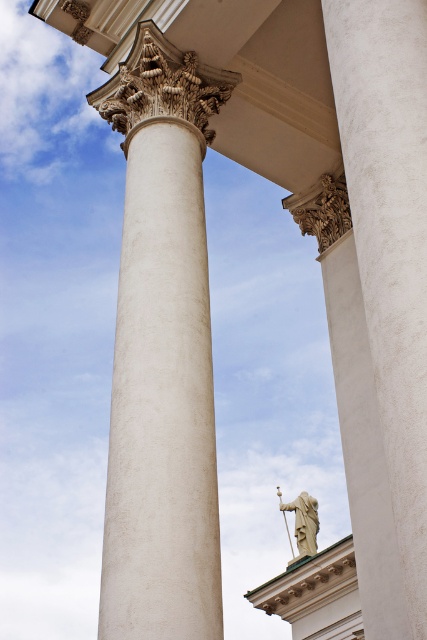
Question: Among these points, which one is nearest to the camera?

Choices:
 (A) (312, 540)
 (B) (389, 413)
 (C) (204, 356)

Answer: (B)

Question: Is the position of white smooth column at center less distant than that of stone statue at center?

Choices:
 (A) no
 (B) yes

Answer: (B)

Question: Is white smooth column at center above stone statue at center?

Choices:
 (A) yes
 (B) no

Answer: (A)

Question: Which point is farther from the camera taking this photo?

Choices:
 (A) (181, 548)
 (B) (301, 513)
 (C) (342, 42)

Answer: (B)

Question: Which is nearer to the white marble column at center?

Choices:
 (A) white smooth column at center
 (B) stone statue at center

Answer: (A)

Question: Can you confirm if white marble column at center is wider than stone statue at center?

Choices:
 (A) no
 (B) yes

Answer: (A)